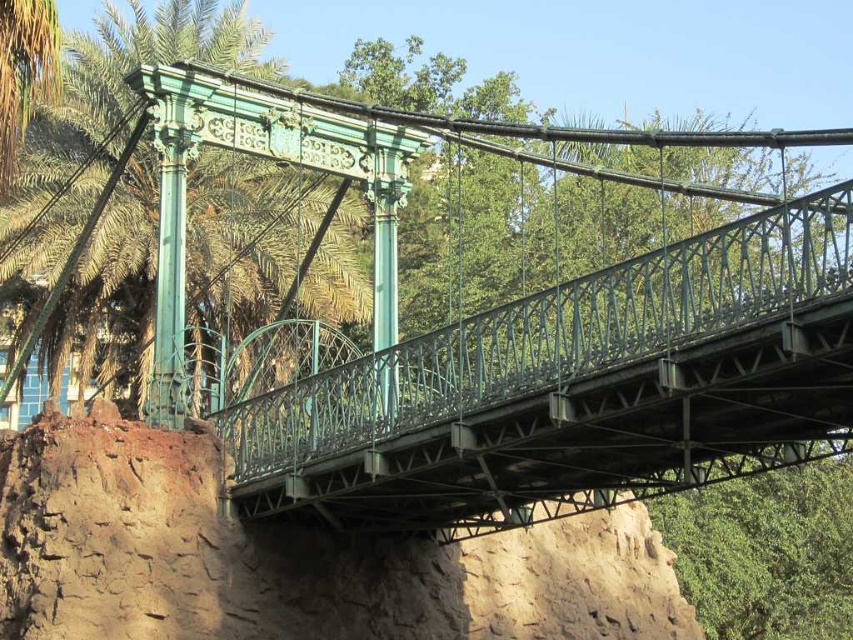
Can you confirm if brown rough cliff at lower center is positioned to the left of green metal palm tree at left?

No, brown rough cliff at lower center is not to the left of green metal palm tree at left.

Is brown rough cliff at lower center taller than green metal palm tree at left?

No.

Locate an element on the screen. brown rough cliff at lower center is located at coordinates (288, 557).